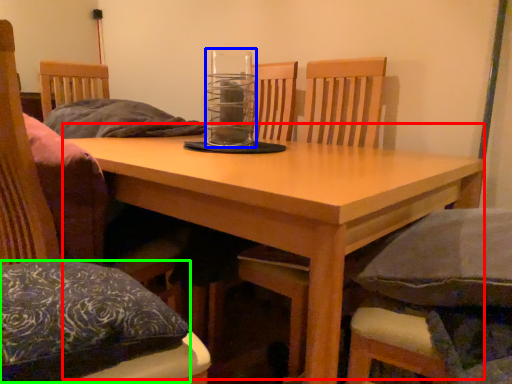
Question: Considering the real-world distances, which object is farthest from table (highlighted by a red box)? glass jar (highlighted by a blue box) or pillow (highlighted by a green box)?

Choices:
 (A) glass jar
 (B) pillow

Answer: (A)